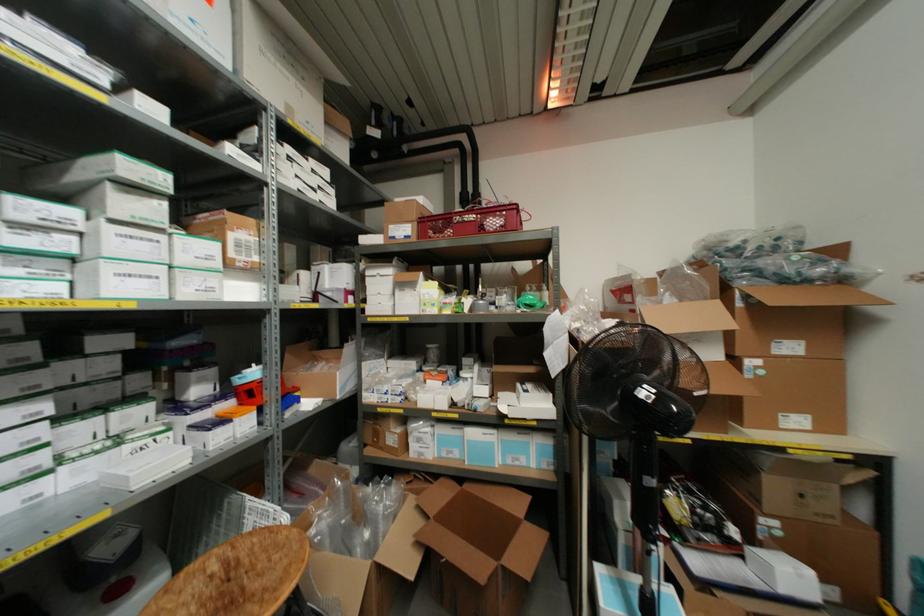
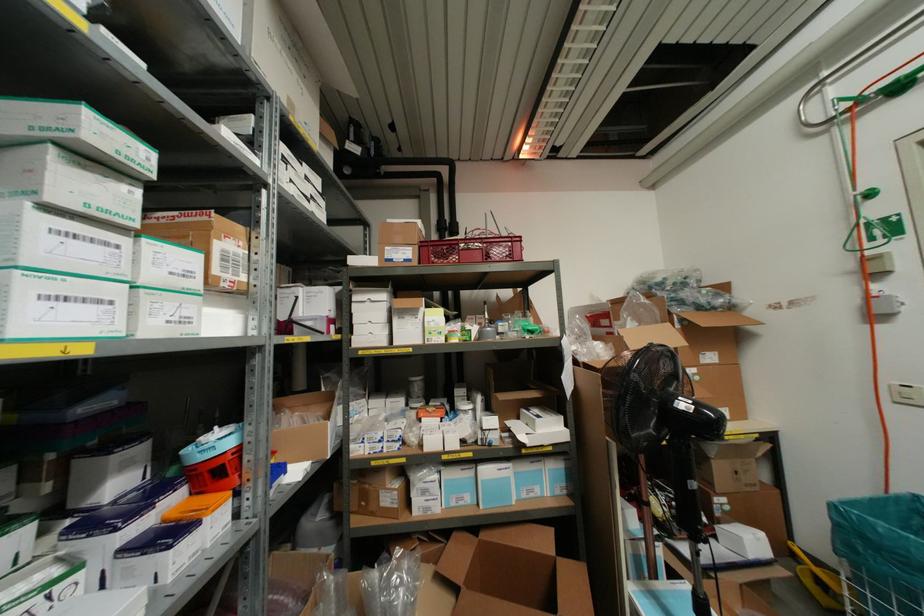
In the second image, find the point that corresponds to the point at 395,200 in the first image.

(388, 220)